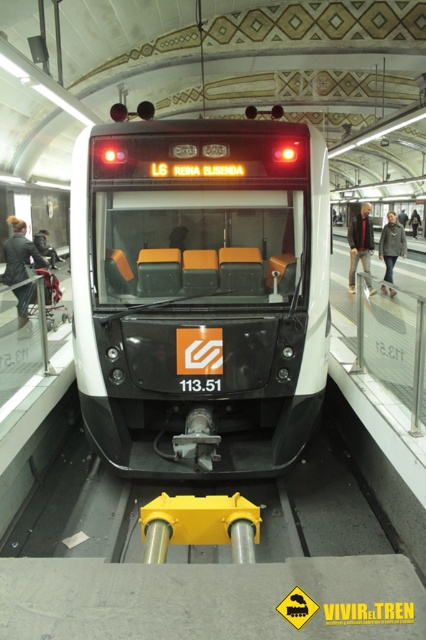
You are waiting for the tram and notice a leather jacket at left on the platform. If you want to pick it up, which direction should you move from your current position?

The leather jacket at left is located at point (19,253), so you should move to your left to reach it.

You are waiting for the tram and see two jackets left on the seats inside the tram. The jackets are a dark brown leather jacket at center and a dark gray jacket at center. You want to pick up the jacket that is closer to you. Which jacket should you choose?

The dark brown leather jacket at center is 8.02 meters away from the dark gray jacket at center. Since you want the closer one, you should choose whichever is nearer. However, the description does not specify which is closer, only the distance between them. Without additional information on their positions relative to your location, it is impossible to determine which jacket is closer to you.

You are a passenger waiting on the platform and see two jackets hanging on a rack between the dark brown leather jacket at center and the dark gray jacket at center. Which jacket would you choose if you want the one that takes up more space?

The dark brown leather jacket at center is larger in size than the dark gray jacket at center, so it takes up more space and would be the one to choose.